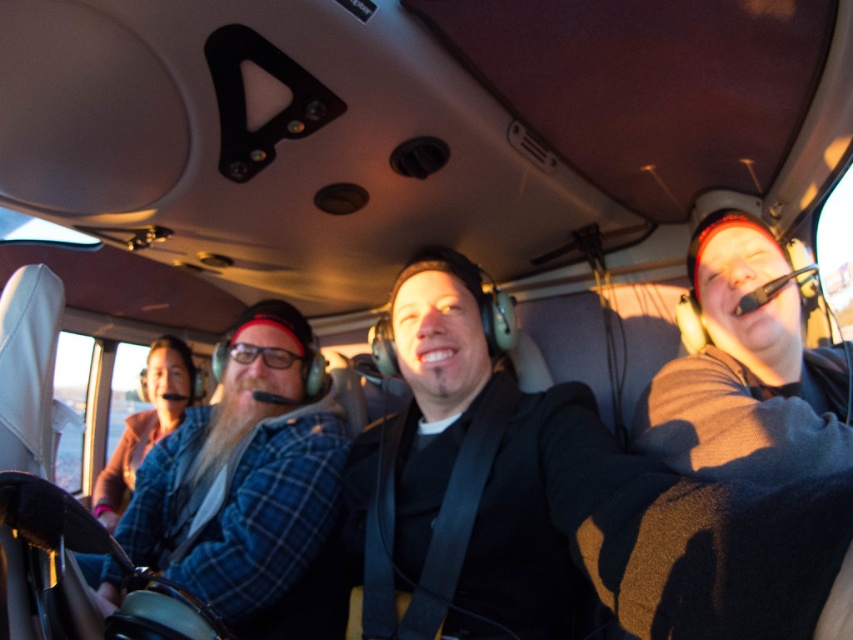
Does point (178, 456) come in front of point (682, 449)?

No, it is not.

The image size is (853, 640). Identify the location of blue plaid shirt at center. (242, 476).